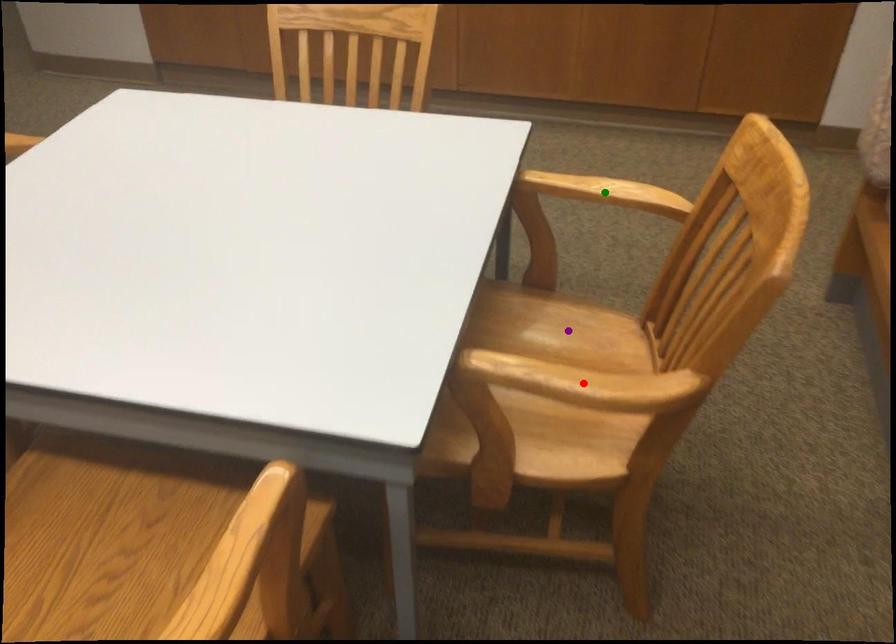
Order these from nearest to farthest:
1. green point
2. red point
3. purple point

red point
green point
purple point